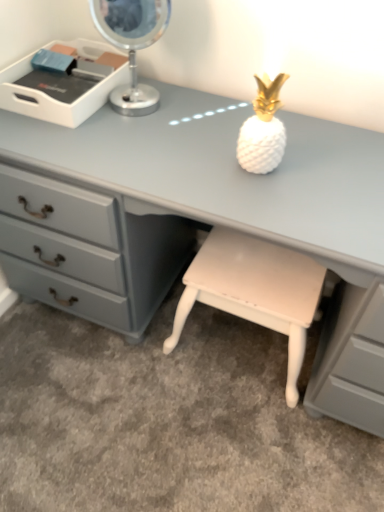
Where is `free space above white glossy stool at lower center (from a real-world perspective)`? This screenshot has width=384, height=512. free space above white glossy stool at lower center (from a real-world perspective) is located at coordinates (252, 271).